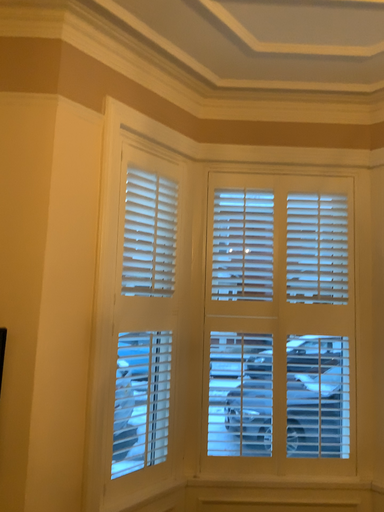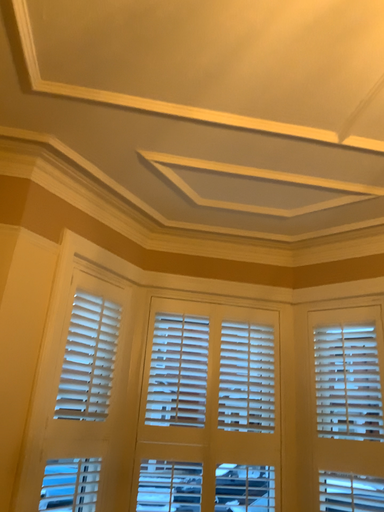
Question: Which way did the camera rotate in the video?

Choices:
 (A) rotated upward
 (B) rotated downward

Answer: (A)